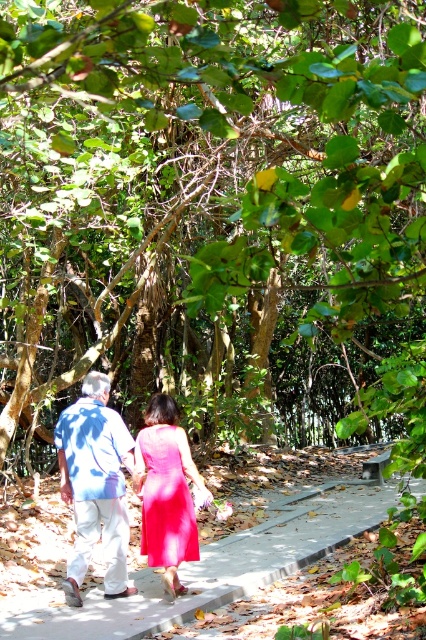
You are a photographer trying to capture both the blue cotton shirt at center and the matte pink dress at center in the same frame. Based on their sizes, which one should you focus on to ensure both are clearly visible in your photo?

The blue cotton shirt at center is larger in size than the matte pink dress at center, so focusing on the blue cotton shirt at center will help ensure both are clearly visible since it occupies more space in the frame.

You are a photographer trying to capture the entire scene in one shot. Given that the gray concrete pavement at center and the matte pink dress at center are both in focus, which object would occupy more of the frame?

The gray concrete pavement at center occupies more of the frame because it is larger in size than the matte pink dress at center.

You are standing at the point marked as point (213, 568). What material is under your feet?

The material under your feet at point (213, 568) is gray concrete pavement.